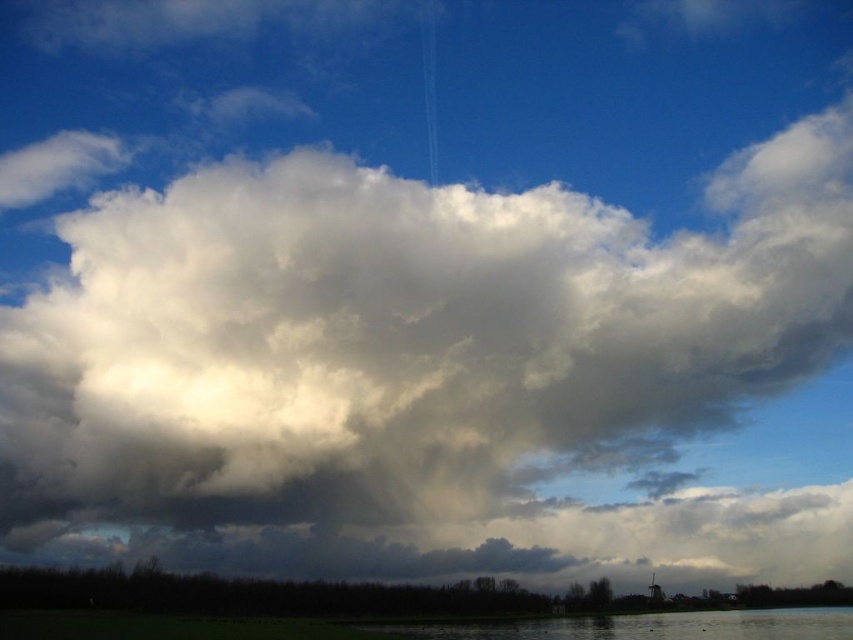
Looking at the sky scene, where is the white fluffy cloud at center in relation to the smooth water at lower center?

The white fluffy cloud at center is to the left of the smooth water at lower center.

You are an observer looking at the sky scene. You notice the white fluffy cloud at center and the smooth water at lower center. Which object is closer to you?

The white fluffy cloud at center is closer to you because the smooth water at lower center is behind it.